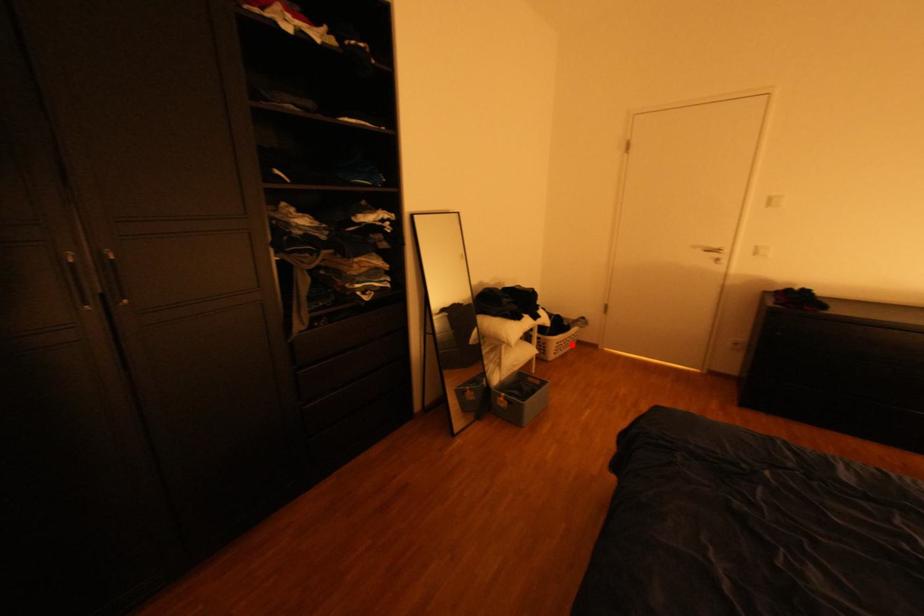
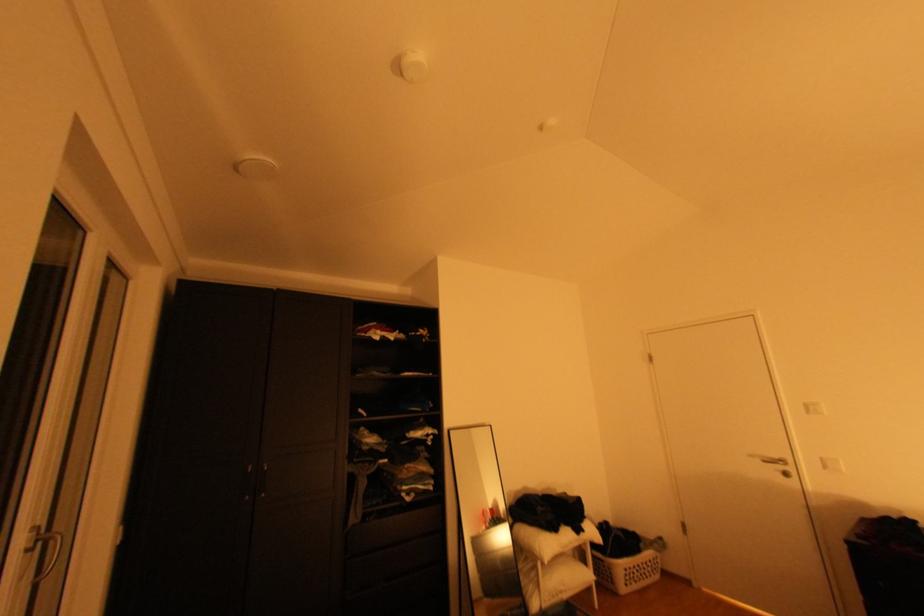
Question: A red point is marked in image1. In image2, is the corresponding 3D point closer to the camera or farther? Reply with the corresponding letter.

Choices:
 (A) The corresponding 3D point is closer.
 (B) The corresponding 3D point is farther.

Answer: (A)